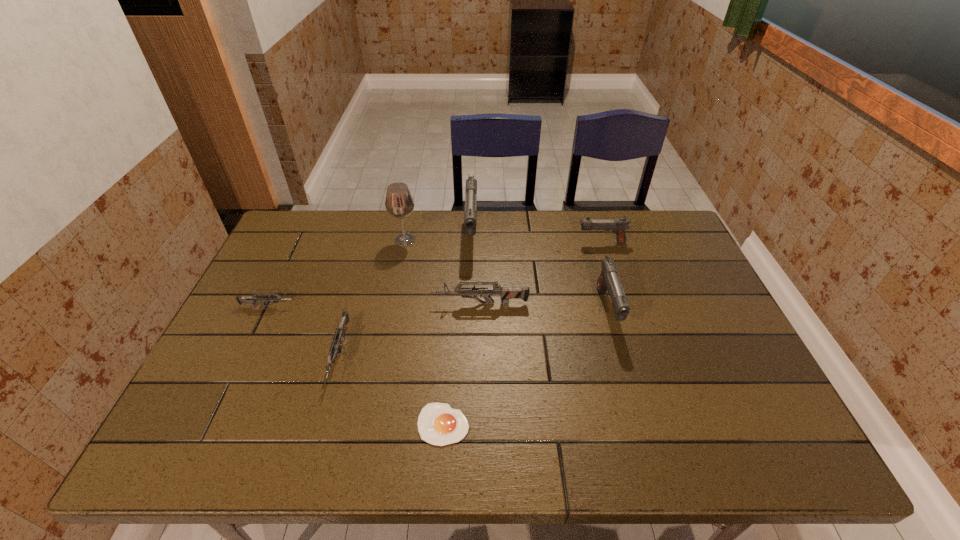
Where is `vacant space located in the direction the fourth tallest object is aimed`? Image resolution: width=960 pixels, height=540 pixels. vacant space located in the direction the fourth tallest object is aimed is located at coordinates (504, 242).

Identify the location of free space located aimed along the barrel of the biggest grey gun. The height and width of the screenshot is (540, 960). (292, 304).

The width and height of the screenshot is (960, 540). Find the location of `vacant space located aimed along the barrel of the biggest grey gun`. vacant space located aimed along the barrel of the biggest grey gun is located at coordinates (412, 304).

Where is `vacant space located aimed along the barrel of the biggest grey gun`? The image size is (960, 540). vacant space located aimed along the barrel of the biggest grey gun is located at coordinates (415, 304).

Where is `vacant area located aimed along the barrel of the nearest grey gun`? The image size is (960, 540). vacant area located aimed along the barrel of the nearest grey gun is located at coordinates (324, 412).

Where is `free location located aimed along the barrel of the shortest gun`? This screenshot has width=960, height=540. free location located aimed along the barrel of the shortest gun is located at coordinates (415, 306).

Identify the location of free space located 0.090m on the right of the shortest object. This screenshot has width=960, height=540. (511, 424).

The height and width of the screenshot is (540, 960). I want to click on wineglass present at the far edge, so click(399, 203).

Locate an element on the screen. This screenshot has height=540, width=960. object present at the near edge is located at coordinates (438, 424).

Locate an element on the screen. The image size is (960, 540). object situated at the left edge is located at coordinates (252, 299).